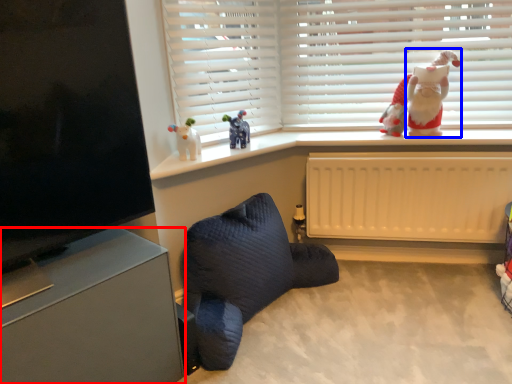
Question: Which object appears farthest to the camera in this image, furniture (highlighted by a red box) or santa claus (highlighted by a blue box)?

Choices:
 (A) furniture
 (B) santa claus

Answer: (B)